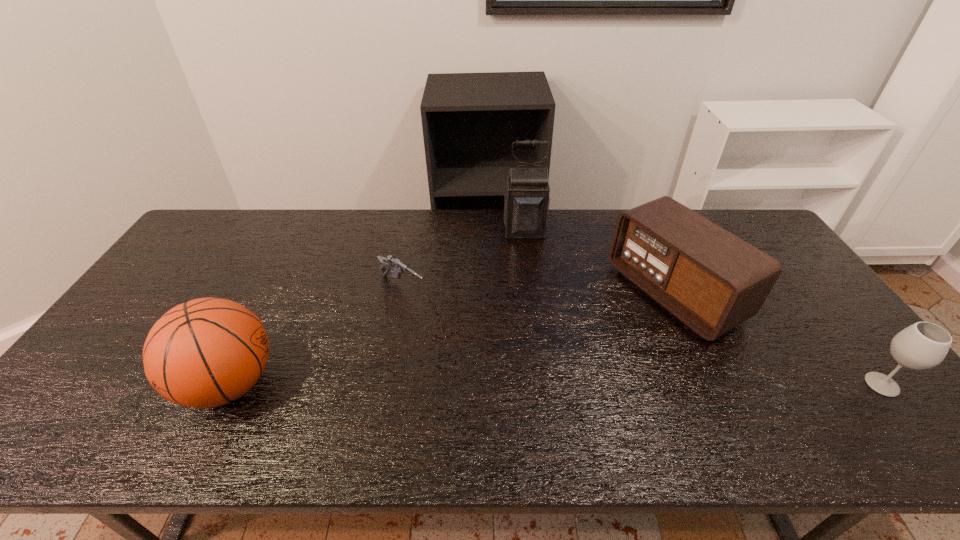
Identify the location of vacant space on the desktop that is between the leftmost object and the wineglass and is positioned on the front-facing side of the third object from right to left. (545, 384).

Identify the location of free space on the desktop that is between the leftmost object and the wineglass and is positioned on the front-facing side of the radio receiver. (494, 384).

At what (x,y) coordinates should I click in order to perform the action: click on free space on the desktop that is between the basketball and the rightmost object and is positioned at the barrel of the gun. Please return your answer as a coordinate pair (x, y). The width and height of the screenshot is (960, 540). Looking at the image, I should click on (544, 384).